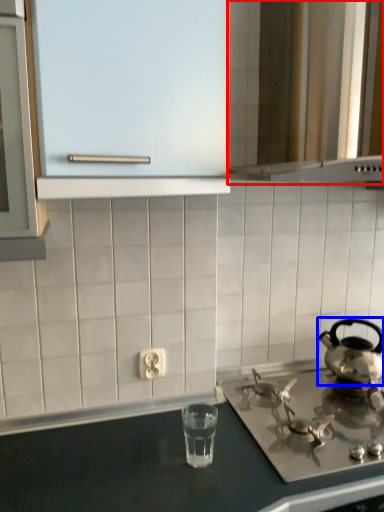
Question: Which object appears farthest to the camera in this image, vent (highlighted by a red box) or kettle (highlighted by a blue box)?

Choices:
 (A) vent
 (B) kettle

Answer: (B)